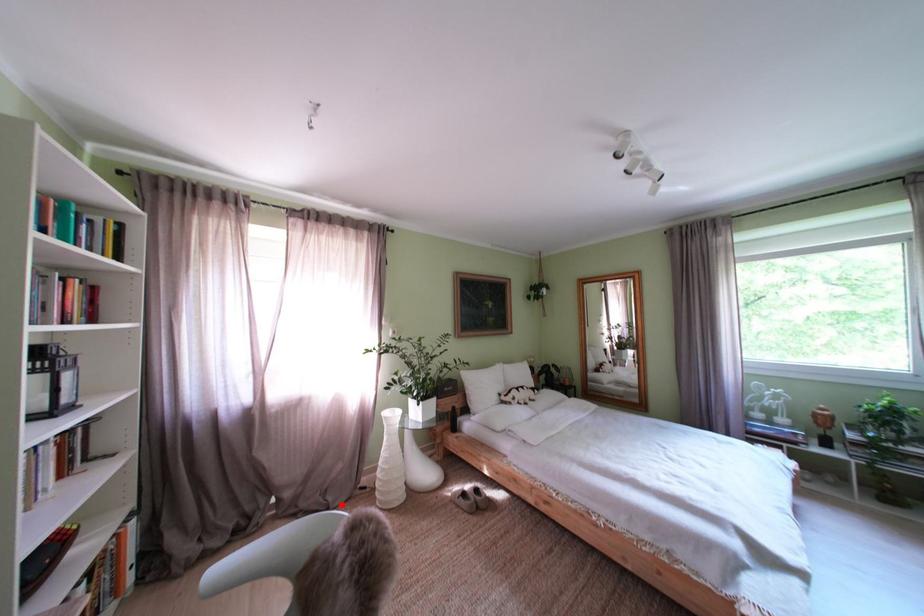
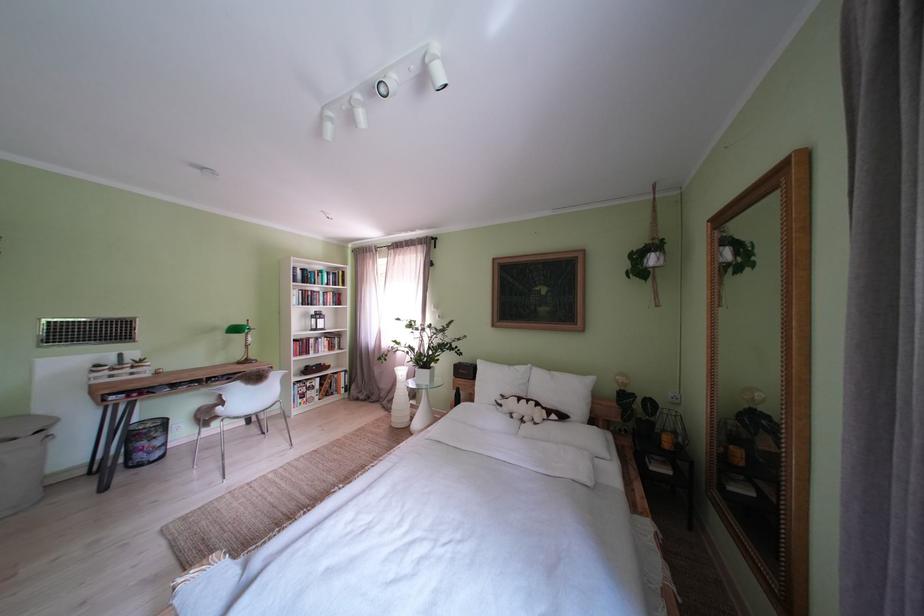
Question: I am providing you with two images of the same scene from different viewpoints. A red point is shown in image1. For the corresponding object point in image2, is it positioned nearer or farther from the camera?

Choices:
 (A) Nearer
 (B) Farther

Answer: (B)